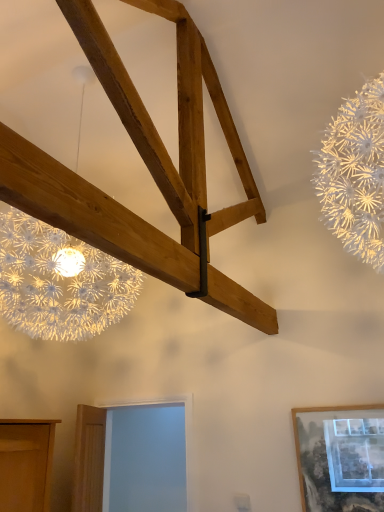
Question: Is blue glass window at lower center oriented towards matte wooden picture frame at lower right?

Choices:
 (A) no
 (B) yes

Answer: (A)

Question: Can you confirm if blue glass window at lower center is positioned to the right of matte wooden picture frame at lower right?

Choices:
 (A) no
 (B) yes

Answer: (A)

Question: Is matte wooden picture frame at lower right completely or partially inside blue glass window at lower center?

Choices:
 (A) yes
 (B) no

Answer: (B)

Question: Is blue glass window at lower center positioned in front of matte wooden picture frame at lower right?

Choices:
 (A) yes
 (B) no

Answer: (B)

Question: Is blue glass window at lower center looking in the opposite direction of matte wooden picture frame at lower right?

Choices:
 (A) no
 (B) yes

Answer: (A)

Question: From the image's perspective, is blue glass window at lower center beneath matte wooden picture frame at lower right?

Choices:
 (A) no
 (B) yes

Answer: (B)

Question: From the image's perspective, would you say matte wooden picture frame at lower right is positioned over blue glass window at lower center?

Choices:
 (A) no
 (B) yes

Answer: (B)

Question: Is matte wooden picture frame at lower right far from blue glass window at lower center?

Choices:
 (A) yes
 (B) no

Answer: (A)

Question: Does matte wooden picture frame at lower right appear on the left side of blue glass window at lower center?

Choices:
 (A) no
 (B) yes

Answer: (A)

Question: Can you confirm if matte wooden picture frame at lower right is thinner than blue glass window at lower center?

Choices:
 (A) yes
 (B) no

Answer: (A)

Question: Is matte wooden picture frame at lower right shorter than blue glass window at lower center?

Choices:
 (A) yes
 (B) no

Answer: (A)

Question: Can you confirm if matte wooden picture frame at lower right is positioned to the right of blue glass window at lower center?

Choices:
 (A) no
 (B) yes

Answer: (B)

Question: From a real-world perspective, is matte wooden picture frame at lower right above or below blue glass window at lower center?

Choices:
 (A) below
 (B) above

Answer: (A)